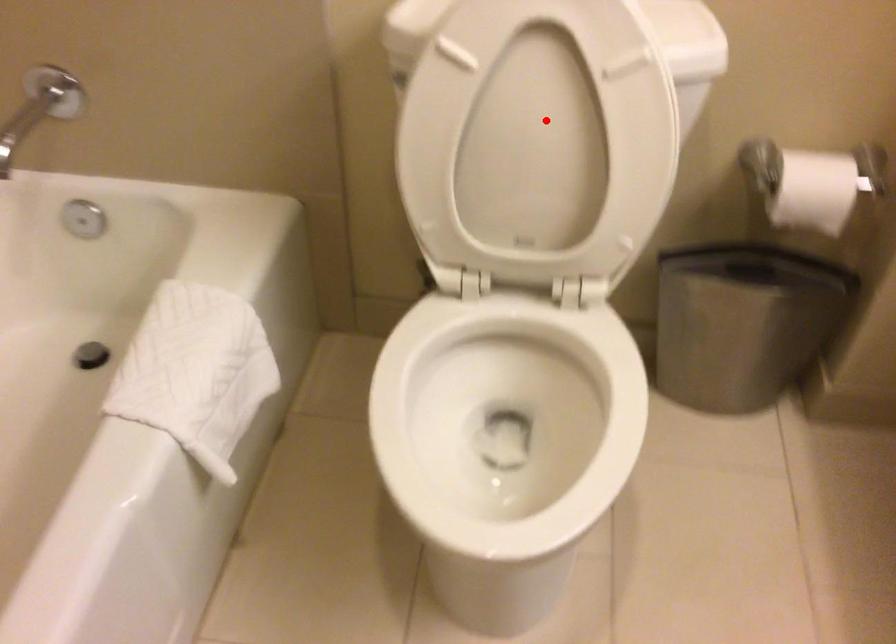
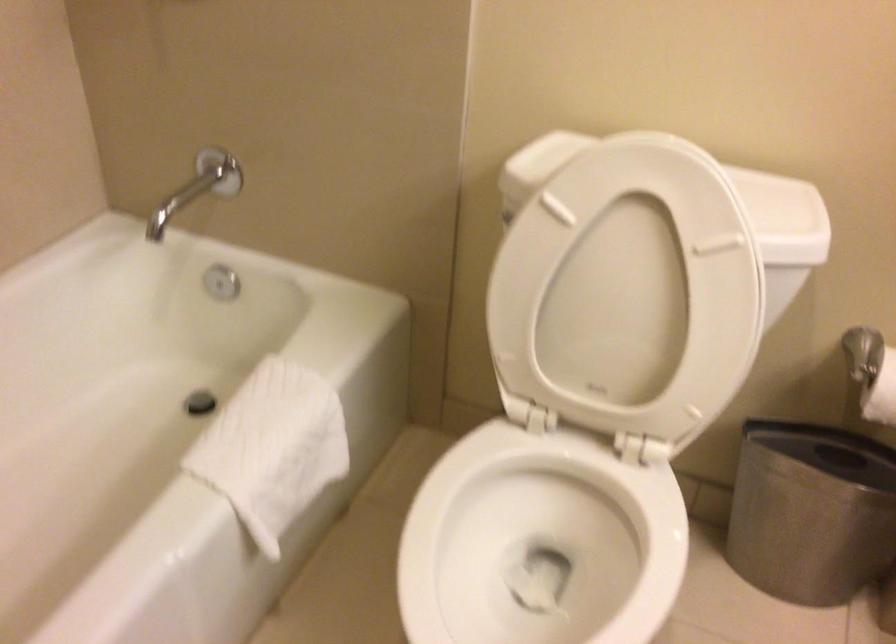
Find the pixel in the second image that matches the highlighted location in the first image.

(633, 285)